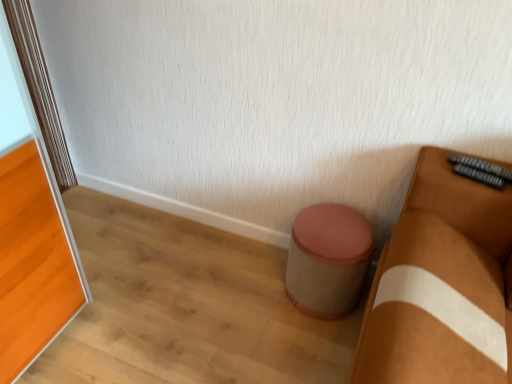
Question: From a real-world perspective, is beige fabric stool at center above or below orange glossy screen door at left?

Choices:
 (A) above
 (B) below

Answer: (B)

Question: Looking at the image, does beige fabric stool at center seem bigger or smaller compared to orange glossy screen door at left?

Choices:
 (A) big
 (B) small

Answer: (B)

Question: Is beige fabric stool at center to the left or to the right of orange glossy screen door at left in the image?

Choices:
 (A) right
 (B) left

Answer: (A)

Question: From a real-world perspective, is orange glossy screen door at left physically located above or below beige fabric stool at center?

Choices:
 (A) below
 (B) above

Answer: (B)

Question: From their relative heights in the image, would you say orange glossy screen door at left is taller or shorter than beige fabric stool at center?

Choices:
 (A) short
 (B) tall

Answer: (B)

Question: From the image's perspective, is orange glossy screen door at left above or below beige fabric stool at center?

Choices:
 (A) below
 (B) above

Answer: (B)

Question: Based on their sizes in the image, would you say orange glossy screen door at left is bigger or smaller than beige fabric stool at center?

Choices:
 (A) big
 (B) small

Answer: (A)